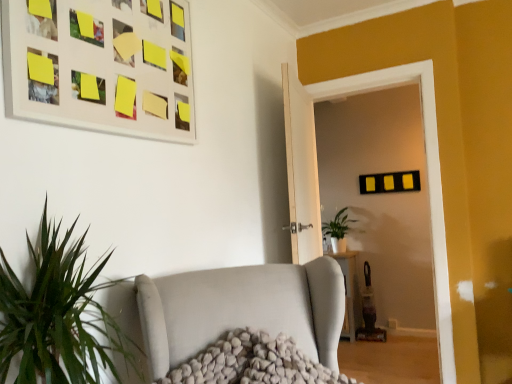
Question: From a real-world perspective, does white textured studio couch at center stand above green matte plant at center?

Choices:
 (A) yes
 (B) no

Answer: (B)

Question: Is white textured studio couch at center facing away from green matte plant at center?

Choices:
 (A) no
 (B) yes

Answer: (A)

Question: From a real-world perspective, is white textured studio couch at center beneath green matte plant at center?

Choices:
 (A) no
 (B) yes

Answer: (B)

Question: Is white textured studio couch at center facing towards green matte plant at center?

Choices:
 (A) yes
 (B) no

Answer: (B)

Question: Is white textured studio couch at center outside green matte plant at center?

Choices:
 (A) no
 (B) yes

Answer: (B)

Question: Considering the relative sizes of white textured studio couch at center and green matte plant at center in the image provided, is white textured studio couch at center smaller than green matte plant at center?

Choices:
 (A) yes
 (B) no

Answer: (A)

Question: Can we say matte black glass door at center lies outside matte white picture frame at upper left?

Choices:
 (A) yes
 (B) no

Answer: (A)

Question: Is matte black glass door at center not near matte white picture frame at upper left?

Choices:
 (A) no
 (B) yes

Answer: (B)

Question: Is matte black glass door at center positioned behind matte white picture frame at upper left?

Choices:
 (A) yes
 (B) no

Answer: (A)

Question: Can you confirm if matte black glass door at center is wider than matte white picture frame at upper left?

Choices:
 (A) yes
 (B) no

Answer: (A)

Question: Does matte black glass door at center have a larger size compared to matte white picture frame at upper left?

Choices:
 (A) yes
 (B) no

Answer: (A)

Question: Is matte black glass door at center at the left side of matte white picture frame at upper left?

Choices:
 (A) no
 (B) yes

Answer: (A)

Question: Is green matte plant at center in contact with matte black glass door at center?

Choices:
 (A) yes
 (B) no

Answer: (B)